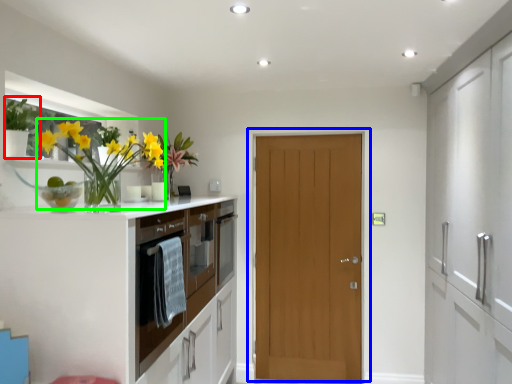
Question: Estimate the real-world distances between objects in this image. Which object is farther from plant (highlighted by a red box), door (highlighted by a blue box) or floral arrangement (highlighted by a green box)?

Choices:
 (A) door
 (B) floral arrangement

Answer: (A)